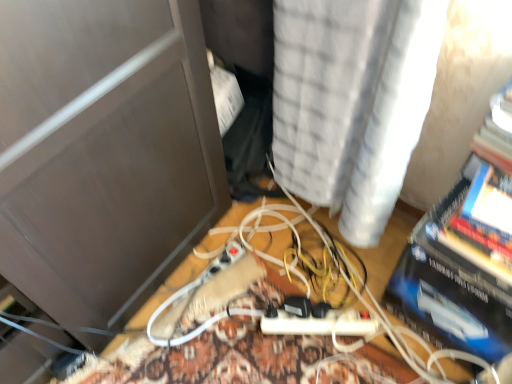
Question: Does point (273, 150) appear closer or farther from the camera than point (432, 238)?

Choices:
 (A) farther
 (B) closer

Answer: (A)

Question: Relative to blue glossy paperback book at right, is white textured curtain at upper center in front or behind?

Choices:
 (A) front
 (B) behind

Answer: (A)

Question: In terms of width, does white textured curtain at upper center look wider or thinner when compared to blue glossy paperback book at right?

Choices:
 (A) thin
 (B) wide

Answer: (B)

Question: From the image's perspective, is blue glossy paperback book at right positioned above or below white textured curtain at upper center?

Choices:
 (A) below
 (B) above

Answer: (A)

Question: Considering their positions, is blue glossy paperback book at right located in front of or behind white textured curtain at upper center?

Choices:
 (A) behind
 (B) front

Answer: (A)

Question: Which is correct: blue glossy paperback book at right is inside white textured curtain at upper center, or outside of it?

Choices:
 (A) outside
 (B) inside

Answer: (A)

Question: From a real-world perspective, is blue glossy paperback book at right physically located above or below white textured curtain at upper center?

Choices:
 (A) below
 (B) above

Answer: (A)